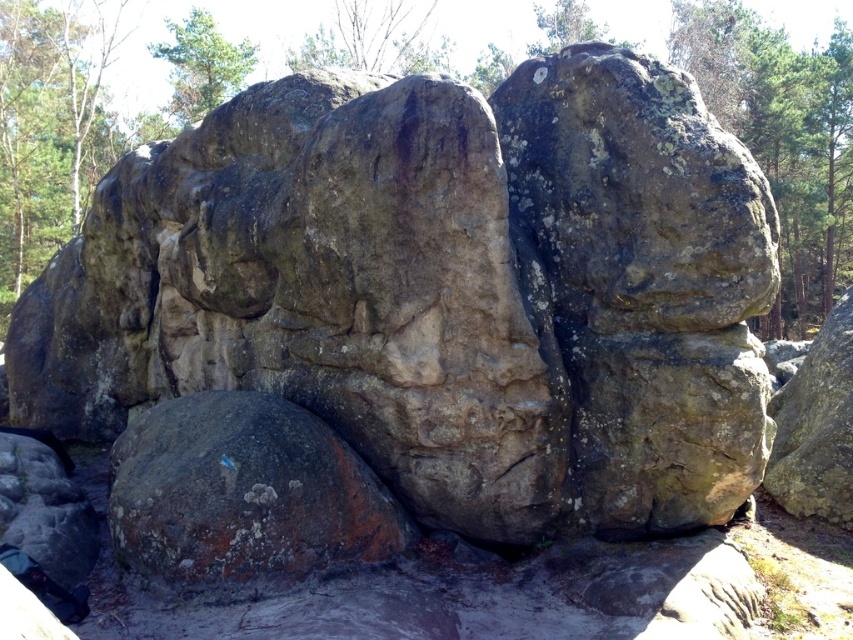
Which is more to the right, green mossy rock at center or brown rough rock at right?

brown rough rock at right

Is green mossy rock at center bigger than brown rough rock at right?

Actually, green mossy rock at center might be smaller than brown rough rock at right.

At what (x,y) coordinates should I click in order to perform the action: click on green mossy rock at center. Please return your answer as a coordinate pair (x, y). Looking at the image, I should click on (635, 193).

Between point (175, 502) and point (235, 81), which one is positioned behind?

The point (235, 81) is more distant.

Does brown rough rock at center have a lesser height compared to green leafy tree at upper left?

Indeed, brown rough rock at center has a lesser height compared to green leafy tree at upper left.

What do you see at coordinates (244, 497) in the screenshot?
I see `brown rough rock at center` at bounding box center [244, 497].

Identify the location of brown rough rock at center. The width and height of the screenshot is (853, 640). (244, 497).

Which is below, green mossy rock at center or brown rough rock at center?

brown rough rock at center

Does green mossy rock at center come in front of brown rough rock at center?

No.

Based on the photo, who is more forward, (653, 180) or (209, 440)?

Point (653, 180) is more forward.

At what (x,y) coordinates should I click in order to perform the action: click on green mossy rock at center. Please return your answer as a coordinate pair (x, y). This screenshot has width=853, height=640. Looking at the image, I should click on (635, 193).